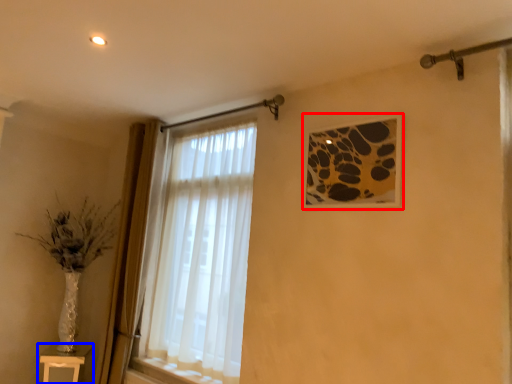
Question: Which of the following is the farthest to the observer, picture frame (highlighted by a red box) or table (highlighted by a blue box)?

Choices:
 (A) picture frame
 (B) table

Answer: (B)